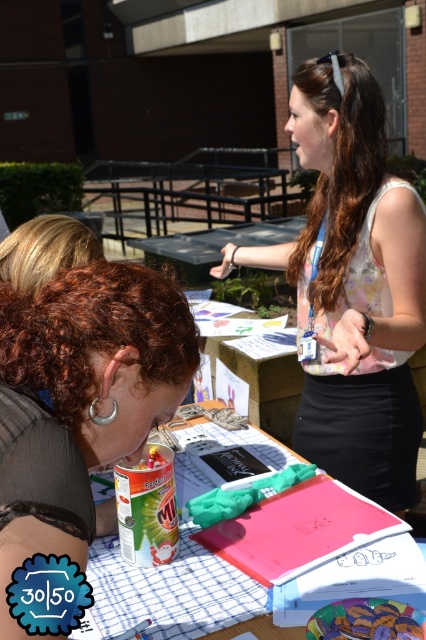
Does pink matte folder at center appear on the right side of matte plastic toy at center?

In fact, pink matte folder at center is to the left of matte plastic toy at center.

From the picture: Does pink matte folder at center have a smaller size compared to matte plastic toy at center?

No, pink matte folder at center is not smaller than matte plastic toy at center.

Is point (282, 461) positioned in front of point (391, 636)?

No, it is behind (391, 636).

This screenshot has height=640, width=426. I want to click on pink matte folder at center, so click(167, 593).

Is curly hair at center shorter than matte plastic toy at center?

In fact, curly hair at center may be taller than matte plastic toy at center.

Based on the photo, can you confirm if curly hair at center is positioned to the right of matte plastic toy at center?

Incorrect, curly hair at center is not on the right side of matte plastic toy at center.

Which is behind, point (86, 266) or point (365, 630)?

The point (86, 266) is more distant.

Find the location of a particular element. The height and width of the screenshot is (640, 426). curly hair at center is located at coordinates (77, 419).

Does floral fabric blouse at center have a lesser width compared to curly hair at center?

Incorrect, floral fabric blouse at center's width is not less than curly hair at center's.

Which is in front, point (353, 268) or point (146, 314)?

Point (146, 314) is in front.

Between point (316, 211) and point (92, 452), which one is positioned behind?

Point (316, 211)

I want to click on floral fabric blouse at center, so click(x=353, y=285).